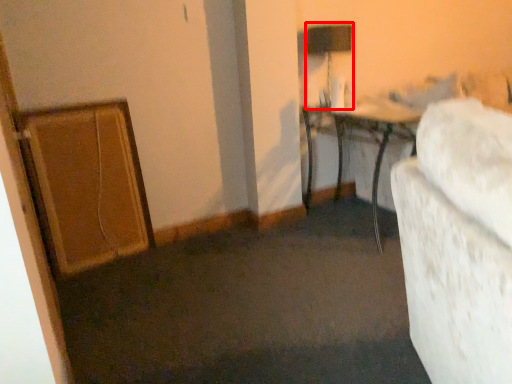
Question: From the image's perspective, where is table lamp (annotated by the red box) located in relation to table in the image?

Choices:
 (A) above
 (B) below

Answer: (A)